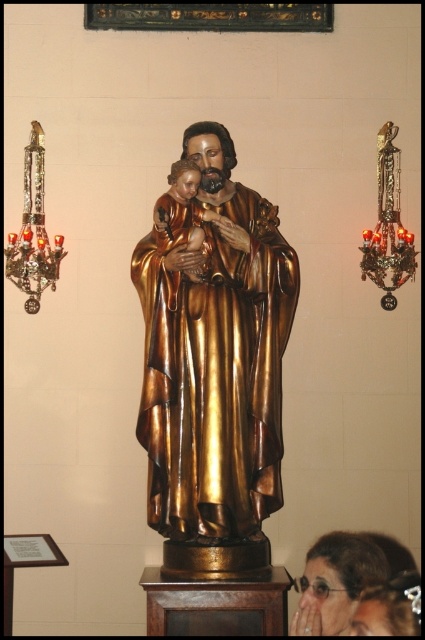
Question: Is gold polished wood statue at center positioned in front of matte gold statue at center?

Choices:
 (A) no
 (B) yes

Answer: (B)

Question: Which point is closer to the camera?

Choices:
 (A) matte gold statue at center
 (B) gold polished wood statue at center

Answer: (B)

Question: In this image, where is gold polished wood statue at center located relative to matte gold statue at center?

Choices:
 (A) above
 (B) below

Answer: (A)

Question: Is gold polished wood statue at center behind matte gold statue at center?

Choices:
 (A) yes
 (B) no

Answer: (B)

Question: Among these objects, which one is nearest to the camera?

Choices:
 (A) matte gold statue at center
 (B) gold polished wood statue at center

Answer: (B)